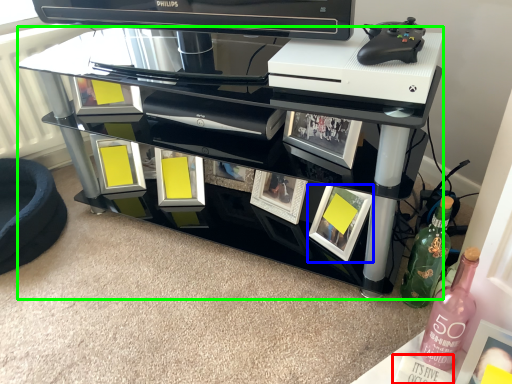
Question: Which object is positioned closest to magazine (highlighted by a red box)? Select from picture frame (highlighted by a blue box) and table (highlighted by a green box).

Choices:
 (A) picture frame
 (B) table

Answer: (A)